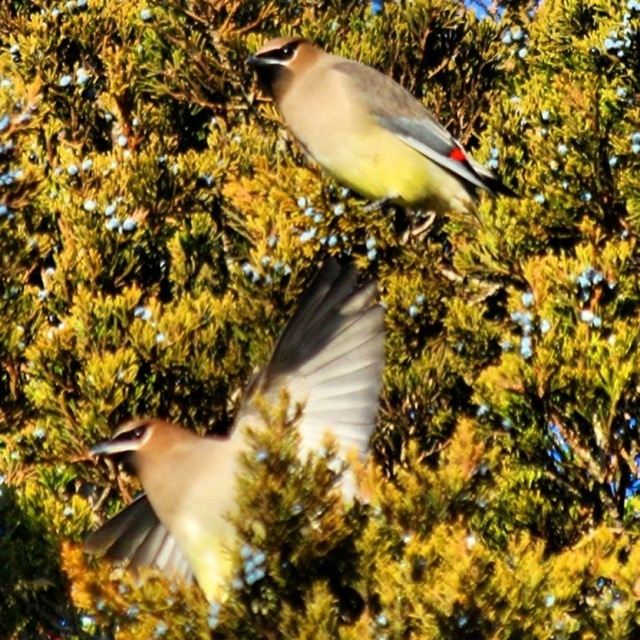
This screenshot has height=640, width=640. I want to click on matte brown bird at center, so click(241, 435).

From the picture: Between matte brown bird at center and matte gray bird at upper center, which one is positioned lower?

matte brown bird at center is lower down.

I want to click on matte brown bird at center, so click(x=241, y=435).

The width and height of the screenshot is (640, 640). Find the location of `matte brown bird at center`. matte brown bird at center is located at coordinates (241, 435).